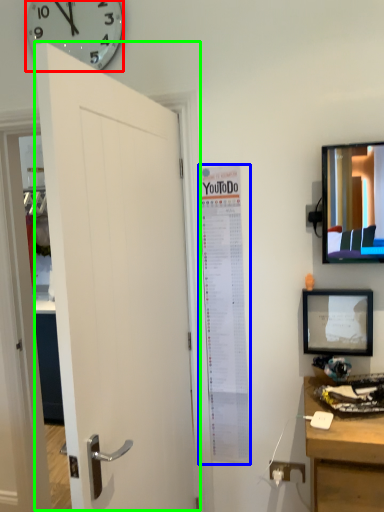
Question: Considering the real-world distances, which object is farthest from wall clock (highlighted by a red box)? poster page (highlighted by a blue box) or door (highlighted by a green box)?

Choices:
 (A) poster page
 (B) door

Answer: (A)